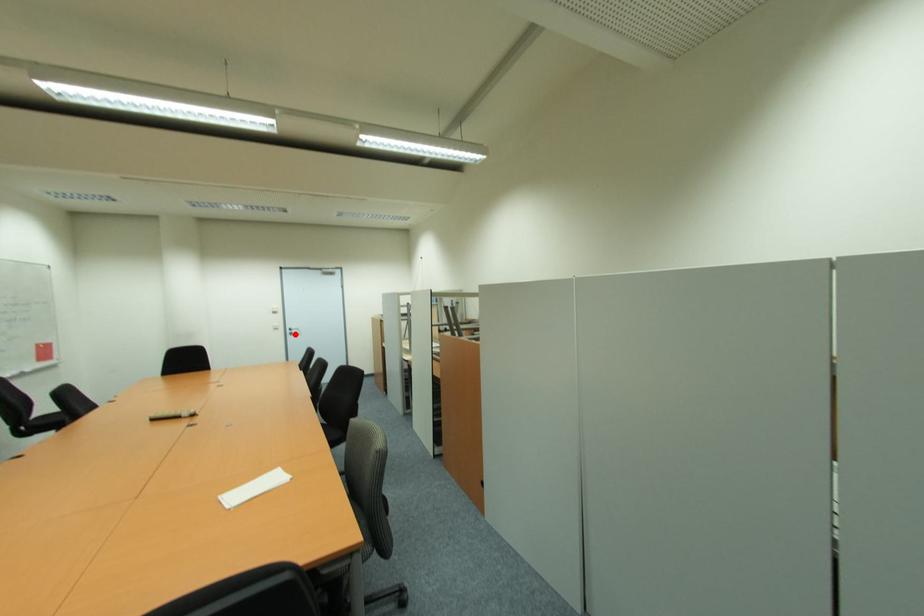
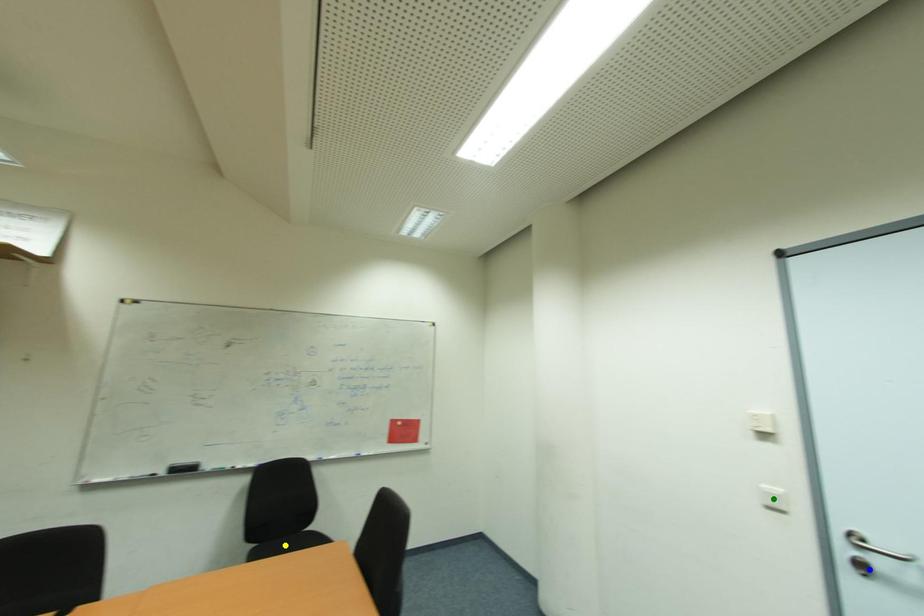
Question: I am providing you with two images of the same scene from different viewpoints. A red point is marked on the first image. You are given multiple points on the second image. In image 2, which mark is for the same physical point as the one in image 1?

Choices:
 (A) yellow point
 (B) blue point
 (C) green point

Answer: (B)